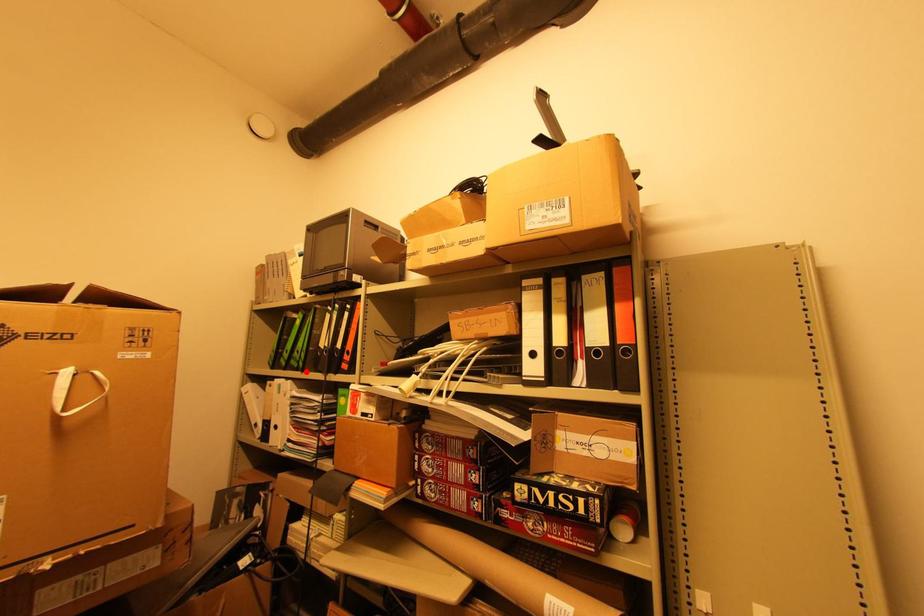
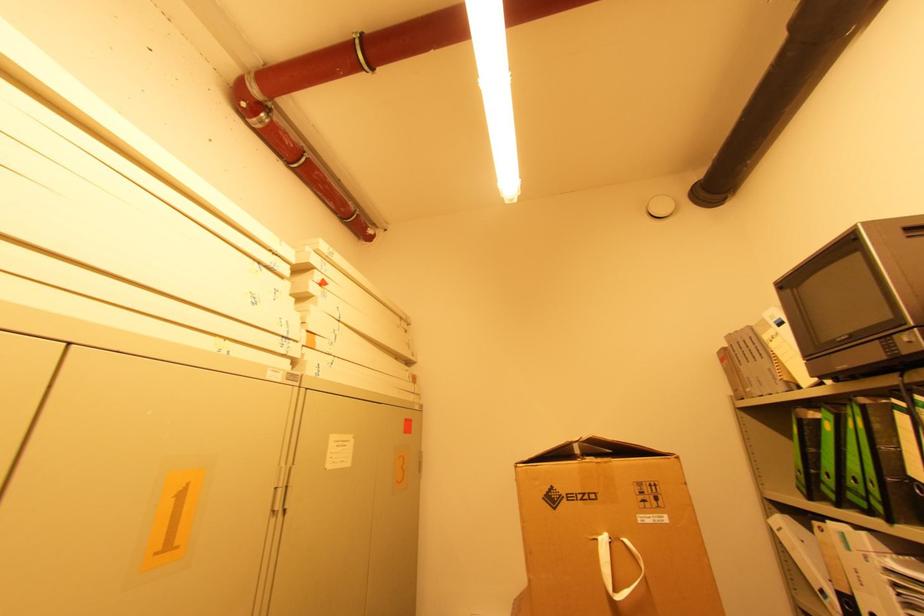
In the second image, find the point that corresponds to the highlighted location in the first image.

(894, 522)